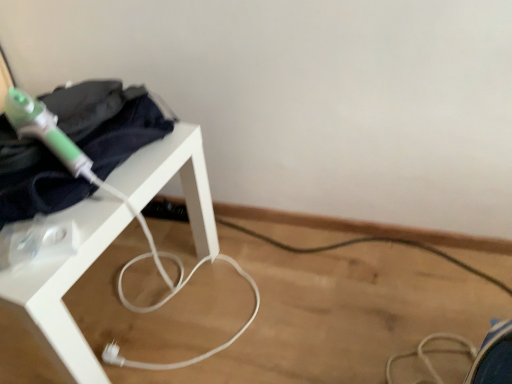
The height and width of the screenshot is (384, 512). What are the coordinates of `dark blue fabric at upper left` in the screenshot? It's located at (108, 120).

What do you see at coordinates (108, 120) in the screenshot? The image size is (512, 384). I see `dark blue fabric at upper left` at bounding box center [108, 120].

Where is `white matte table at left`? white matte table at left is located at coordinates (65, 288).

What do you see at coordinates (65, 288) in the screenshot?
I see `white matte table at left` at bounding box center [65, 288].

In order to click on dark blue fabric at upper left in this screenshot , I will do `click(108, 120)`.

Is white matte table at left to the left or to the right of dark blue fabric at upper left in the image?

white matte table at left is to the left of dark blue fabric at upper left.

In the image, is white matte table at left positioned in front of or behind dark blue fabric at upper left?

Clearly, white matte table at left is in front of dark blue fabric at upper left.

Between point (206, 230) and point (16, 169), which one is positioned in front?

Positioned in front is point (16, 169).

From the image's perspective, between white matte table at left and dark blue fabric at upper left, who is located below?

white matte table at left, from the image's perspective.

From a real-world perspective, which object rests below the other?

white matte table at left.

Which of these two, white matte table at left or dark blue fabric at upper left, is thinner?

Thinner between the two is dark blue fabric at upper left.

Does white matte table at left have a greater height compared to dark blue fabric at upper left?

Yes.

Is white matte table at left bigger than dark blue fabric at upper left?

Yes.

Which is correct: white matte table at left is inside dark blue fabric at upper left, or outside of it?

The correct answer is: outside.

Is white matte table at left not close to dark blue fabric at upper left?

white matte table at left is actually quite close to dark blue fabric at upper left.

Is white matte table at left oriented away from dark blue fabric at upper left?

No, white matte table at left is not facing the opposite direction of dark blue fabric at upper left.

How different are the orientations of white matte table at left and dark blue fabric at upper left in degrees?

0.00232 degrees.

Measure the distance between white matte table at left and dark blue fabric at upper left.

white matte table at left is 5.35 inches from dark blue fabric at upper left.

This screenshot has height=384, width=512. Find the location of `clothing above the white matte table at left (from a real-world perspective)`. clothing above the white matte table at left (from a real-world perspective) is located at coordinates (108, 120).

Does dark blue fabric at upper left appear on the right side of white matte table at left?

Yes, dark blue fabric at upper left is to the right of white matte table at left.

Considering the positions of objects dark blue fabric at upper left and white matte table at left in the image provided, who is behind, dark blue fabric at upper left or white matte table at left?

dark blue fabric at upper left is behind.

Is point (141, 91) positioned after point (152, 144)?

That is True.

From the image's perspective, is dark blue fabric at upper left above or below white matte table at left?

Clearly, from the image's perspective, dark blue fabric at upper left is above white matte table at left.

From a real-world perspective, is dark blue fabric at upper left over white matte table at left?

Correct, in the physical world, dark blue fabric at upper left is higher than white matte table at left.

Looking at their sizes, would you say dark blue fabric at upper left is wider or thinner than white matte table at left?

Considering their sizes, dark blue fabric at upper left looks slimmer than white matte table at left.

Between dark blue fabric at upper left and white matte table at left, which one has more height?

With more height is white matte table at left.

Is dark blue fabric at upper left bigger or smaller than white matte table at left?

dark blue fabric at upper left is smaller than white matte table at left.

Choose the correct answer: Is dark blue fabric at upper left inside white matte table at left or outside it?

dark blue fabric at upper left exists outside the volume of white matte table at left.

Is dark blue fabric at upper left not near white matte table at left?

No, dark blue fabric at upper left is in close proximity to white matte table at left.

Is dark blue fabric at upper left positioned with its back to white matte table at left?

No, dark blue fabric at upper left is not facing away from white matte table at left.

The height and width of the screenshot is (384, 512). What are the coordinates of `clothing above the white matte table at left (from a real-world perspective)` in the screenshot? It's located at (108, 120).

At what (x,y) coordinates should I click in order to perform the action: click on clothing on the right of the white matte table at left. Please return your answer as a coordinate pair (x, y). The height and width of the screenshot is (384, 512). Looking at the image, I should click on (108, 120).

In the image, there is a white matte table at left. At what (x,y) coordinates should I click in order to perform the action: click on clothing above it (from the image's perspective). Please return your answer as a coordinate pair (x, y). The height and width of the screenshot is (384, 512). Looking at the image, I should click on (108, 120).